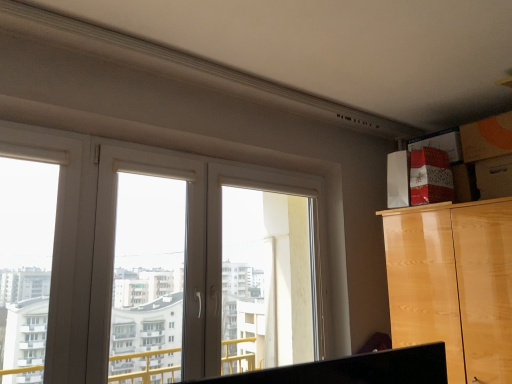
Question: Is white plastic window frame at center, the 2th window frame positioned from the left, taller than white plastic window at center, acting as the first window frame starting from the left?

Choices:
 (A) yes
 (B) no

Answer: (A)

Question: Is white plastic window at center, acting as the first window frame starting from the left, a part of white plastic window frame at center, the 2th window frame positioned from the left?

Choices:
 (A) no
 (B) yes

Answer: (A)

Question: From the image's perspective, is white plastic window frame at center, which ranks as the 1th window frame in right-to-left order, on top of white plastic window at center, which is the 2th window frame from right to left?

Choices:
 (A) no
 (B) yes

Answer: (A)

Question: Considering the relative positions of white plastic window frame at center, the 2th window frame positioned from the left, and white plastic window at center, acting as the first window frame starting from the left, in the image provided, is white plastic window frame at center, the 2th window frame positioned from the left, to the right of white plastic window at center, acting as the first window frame starting from the left, from the viewer's perspective?

Choices:
 (A) yes
 (B) no

Answer: (A)

Question: From the image's perspective, does white plastic window frame at center, which ranks as the 1th window frame in right-to-left order, appear lower than white plastic window at center, which is the 2th window frame from right to left?

Choices:
 (A) no
 (B) yes

Answer: (B)

Question: Are white plastic window frame at center, which ranks as the 1th window frame in right-to-left order, and white plastic window at center, acting as the first window frame starting from the left, located far from each other?

Choices:
 (A) no
 (B) yes

Answer: (A)

Question: Considering the relative sizes of wooden drawer at upper right and white plastic window frame at center, which ranks as the 1th window frame in right-to-left order, in the image provided, is wooden drawer at upper right thinner than white plastic window frame at center, which ranks as the 1th window frame in right-to-left order,?

Choices:
 (A) yes
 (B) no

Answer: (B)

Question: Does wooden drawer at upper right touch white plastic window frame at center, the 2th window frame positioned from the left?

Choices:
 (A) yes
 (B) no

Answer: (B)

Question: Does wooden drawer at upper right have a greater height compared to white plastic window frame at center, the 2th window frame positioned from the left?

Choices:
 (A) yes
 (B) no

Answer: (B)

Question: From the image's perspective, is wooden drawer at upper right beneath white plastic window frame at center, which ranks as the 1th window frame in right-to-left order?

Choices:
 (A) yes
 (B) no

Answer: (B)

Question: Can you confirm if wooden drawer at upper right is bigger than white plastic window frame at center, which ranks as the 1th window frame in right-to-left order?

Choices:
 (A) yes
 (B) no

Answer: (B)

Question: Is wooden drawer at upper right to the left of white plastic window frame at center, the 2th window frame positioned from the left, from the viewer's perspective?

Choices:
 (A) yes
 (B) no

Answer: (B)

Question: Can you confirm if white plastic window at center, acting as the first window frame starting from the left, is wider than glossy wood cabinet at upper right?

Choices:
 (A) no
 (B) yes

Answer: (A)